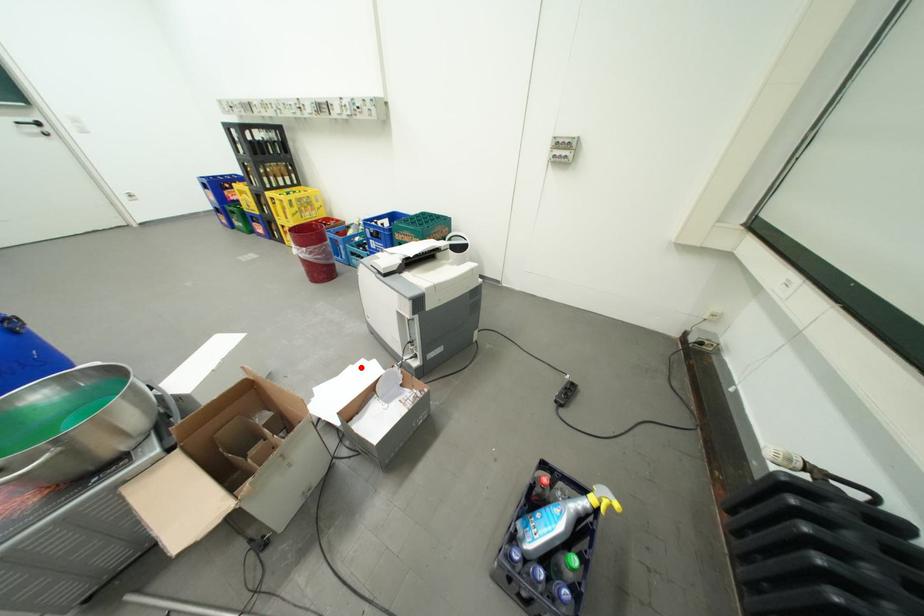
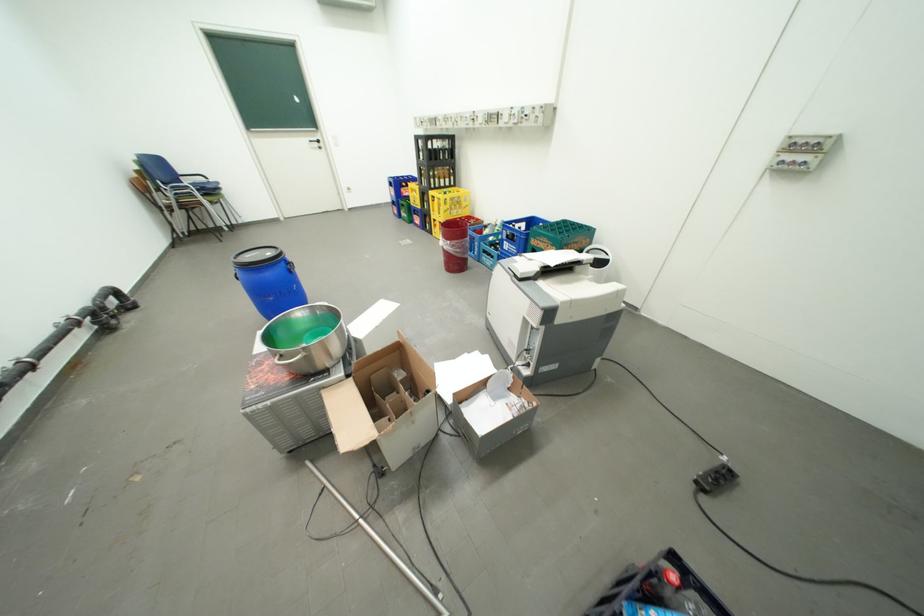
Question: I am providing you with two images of the same scene from different viewpoints. In image1, a red point is highlighted. Considering the same 3D point in image2, which of the following is correct?

Choices:
 (A) It is closer
 (B) It is farther

Answer: (B)